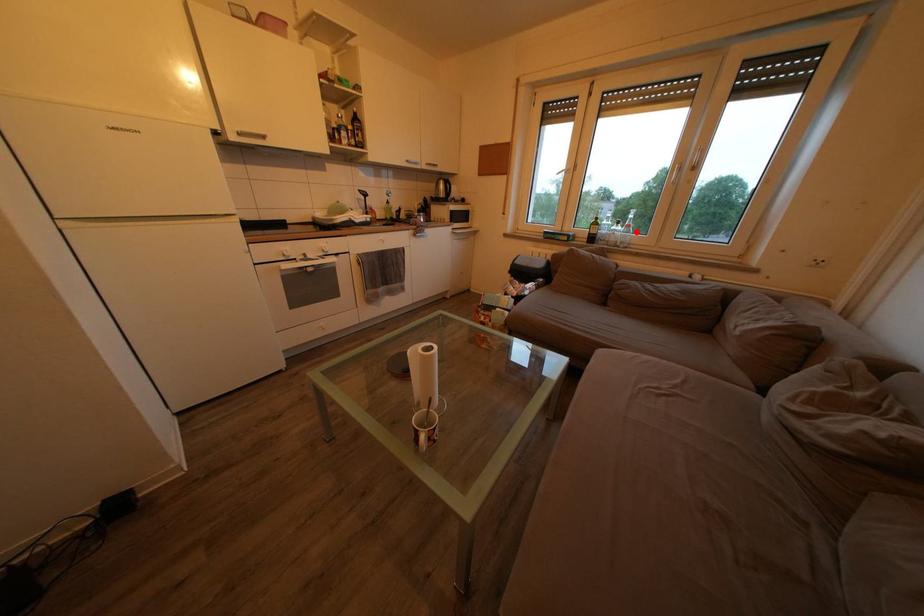
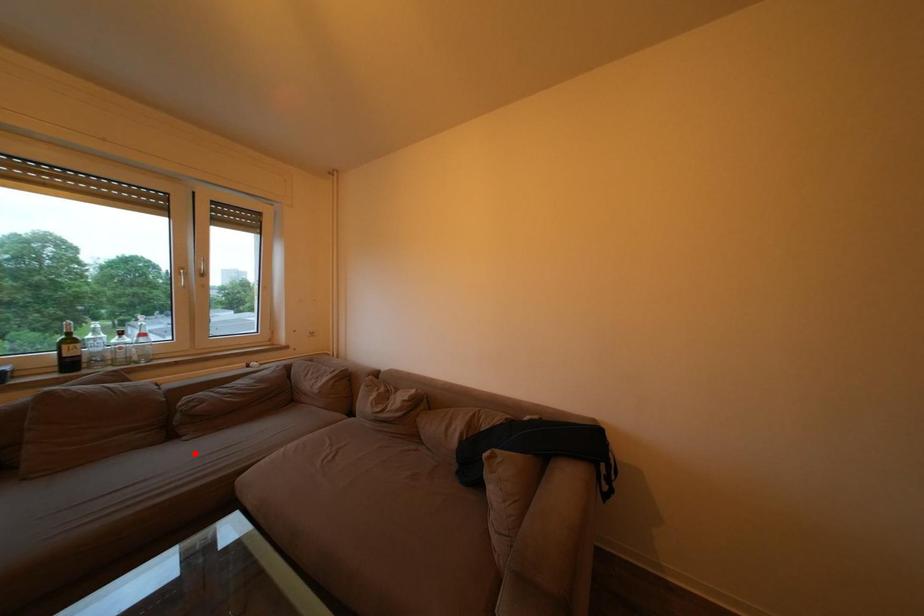
I am providing you with two images of the same scene from different viewpoints. A red point is marked on the first image and another point is marked on the second image. Do the highlighted points in image1 and image2 indicate the same real-world spot?

No